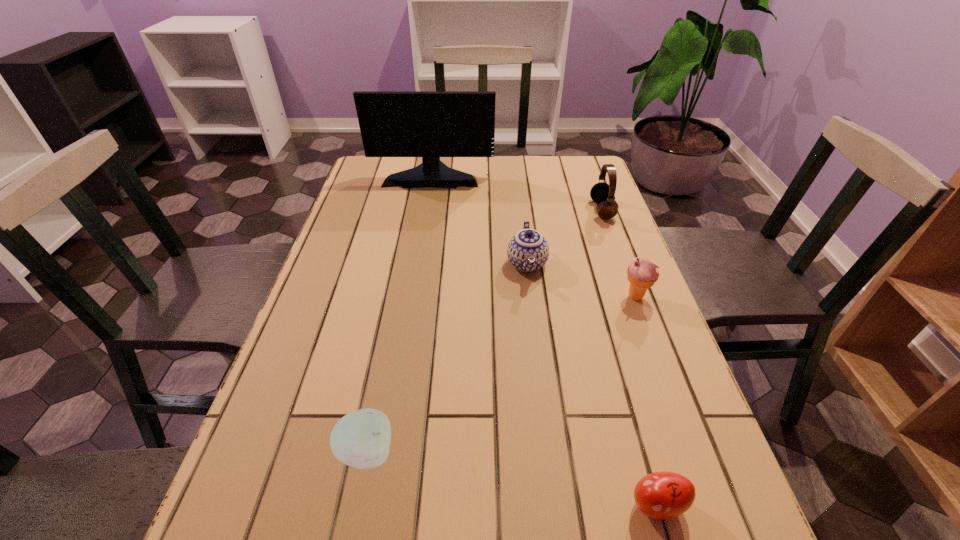
In order to click on the farthest object in this screenshot , I will do `click(430, 124)`.

The image size is (960, 540). What are the coordinates of `the tallest object` in the screenshot? It's located at (430, 124).

In order to click on the fifth nearest object in this screenshot , I will do `click(602, 193)`.

Where is `icecream`? The height and width of the screenshot is (540, 960). icecream is located at coordinates (642, 274).

Locate an element on the screen. chinaware is located at coordinates (528, 250).

Image resolution: width=960 pixels, height=540 pixels. In order to click on the farther apple in this screenshot , I will do `click(361, 439)`.

Where is `the fifth farthest object`? This screenshot has width=960, height=540. the fifth farthest object is located at coordinates (361, 439).

You are a GUI agent. You are given a task and a screenshot of the screen. Output one action in this format:
    pyautogui.click(x=<x>, y=<y>)
    Task: Click on the third object from right to left
    The image size is (960, 540).
    Given the screenshot: What is the action you would take?
    pyautogui.click(x=662, y=495)

Find the location of a particular element. This screenshot has width=960, height=540. the right apple is located at coordinates (662, 495).

Where is `vacant region located 0.290m on the screen side of the farthest object`? The width and height of the screenshot is (960, 540). vacant region located 0.290m on the screen side of the farthest object is located at coordinates (420, 244).